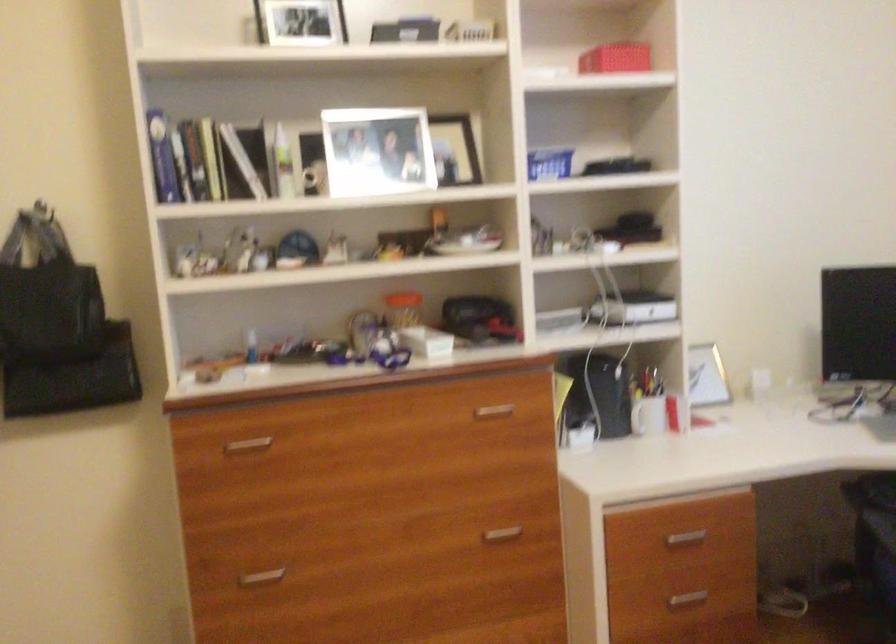
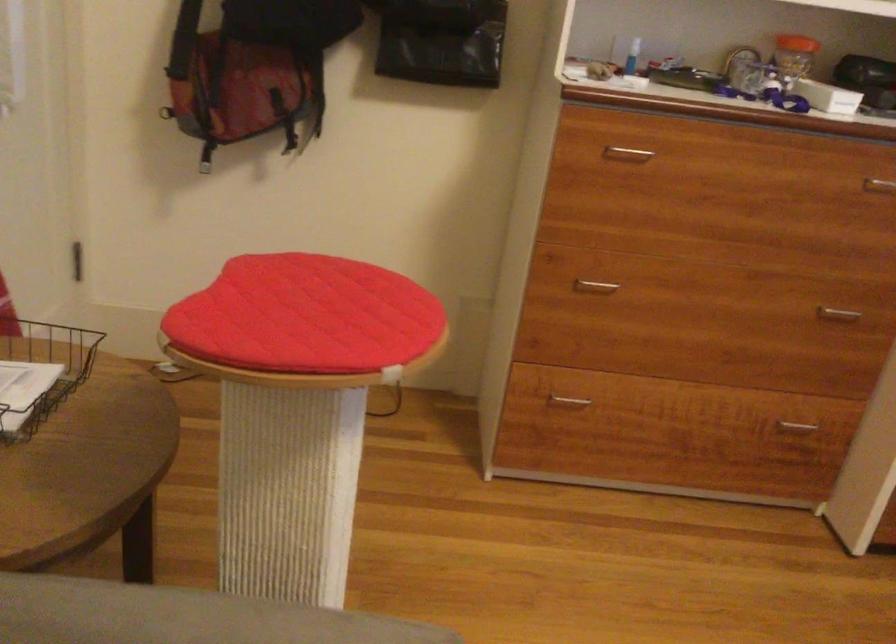
The point at (506, 533) is marked in the first image. Where is the corresponding point in the second image?

(837, 313)